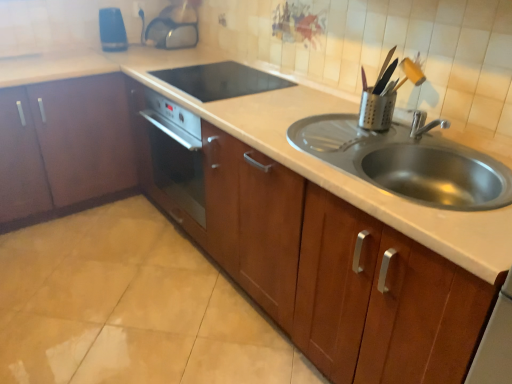
You are a GUI agent. You are given a task and a screenshot of the screen. Output one action in this format:
    pyautogui.click(x=<x>, y=<y>)
    Task: Click on the vacant area on top of transparent plastic kettle at upper center, the second appliance when ordered from left to right (from a real-world perspective)
    The image size is (512, 384).
    Given the screenshot: What is the action you would take?
    pyautogui.click(x=170, y=18)